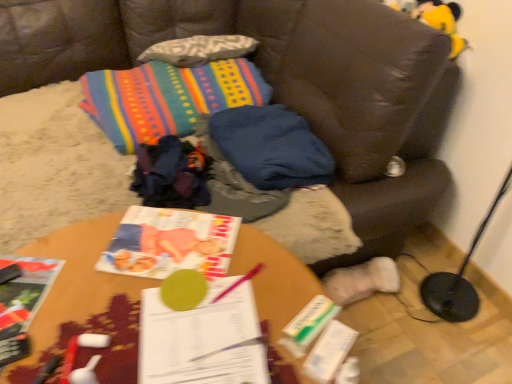
You are a GUI agent. You are given a task and a screenshot of the screen. Output one action in this format:
    pyautogui.click(x=<x>, y=<y>)
    Task: Click on the free space above matte paper book at center, which is counted as the 2th book, starting from the right (from a real-world perspective)
    
    Given the screenshot: What is the action you would take?
    pyautogui.click(x=175, y=242)